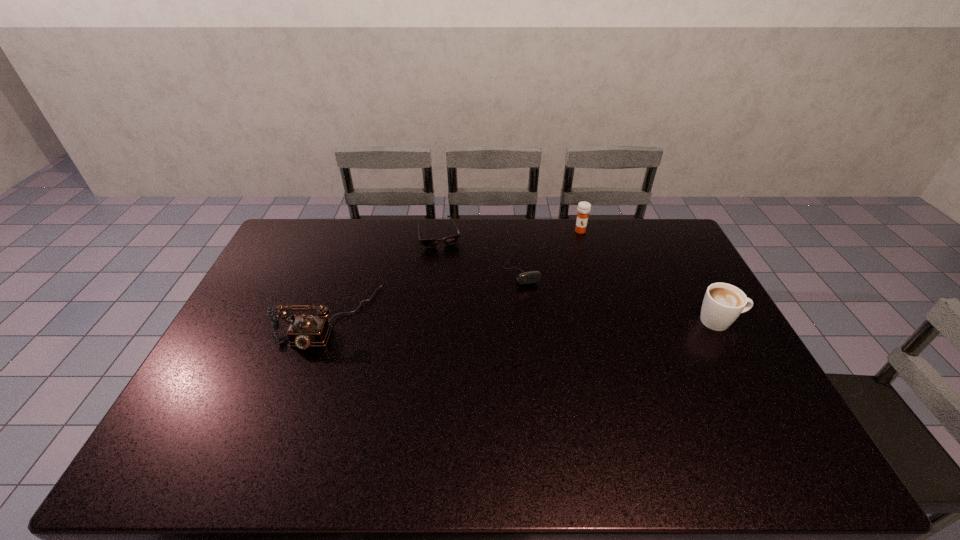
Find the location of a particular element. Image resolution: width=960 pixels, height=540 pixels. free spot on the desktop that is between the leftmost object and the cappuccino and is positioned on the front-facing side of the second shortest object is located at coordinates (544, 320).

The width and height of the screenshot is (960, 540). In order to click on vacant space on the desktop that is between the telephone and the rightmost object and is positioned on the label side of the medicine in this screenshot , I will do `click(574, 320)`.

I want to click on vacant spot on the desktop that is between the telephone and the cappuccino and is positioned on the front-facing side of the fourth object from right to left, so pyautogui.click(x=466, y=319).